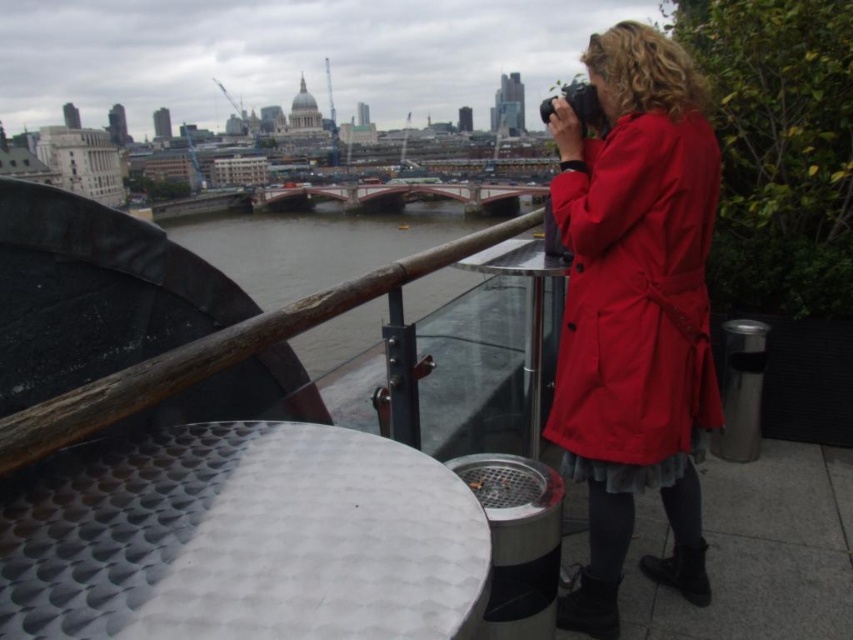
Is matte red coat at right to the right of brown wooden railing at upper center from the viewer's perspective?

Indeed, matte red coat at right is positioned on the right side of brown wooden railing at upper center.

Is point (641, 292) positioned in front of point (347, 280)?

Yes, point (641, 292) is closer to viewer.

In order to click on matte red coat at right in this screenshot , I will do `click(636, 292)`.

Is point (276, 262) positioned behind point (480, 243)?

That is True.

Is brown wooden railing at upper center bigger than brown wooden rail at upper left?

Yes.

You are a GUI agent. You are given a task and a screenshot of the screen. Output one action in this format:
    pyautogui.click(x=<x>, y=<y>)
    Task: Click on the brown wooden railing at upper center
    
    Given the screenshot: What is the action you would take?
    pyautogui.click(x=315, y=246)

The height and width of the screenshot is (640, 853). Find the location of `brown wooden railing at upper center`. brown wooden railing at upper center is located at coordinates (315, 246).

Who is lower down, matte red coat at right or brown wooden rail at upper left?

brown wooden rail at upper left is below.

Does point (570, 269) come closer to viewer compared to point (317, 308)?

No, it is behind (317, 308).

The height and width of the screenshot is (640, 853). I want to click on matte red coat at right, so click(636, 292).